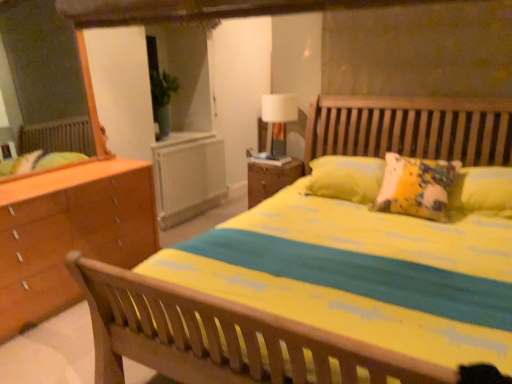
Question: Is point (293, 162) positioned closer to the camera than point (281, 115)?

Choices:
 (A) farther
 (B) closer

Answer: (B)

Question: From the image's perspective, relative to white fabric-covered lamp at upper center, is wooden nightstand at center above or below?

Choices:
 (A) above
 (B) below

Answer: (B)

Question: Which is nearer to the white plastic radiator at center?

Choices:
 (A) wooden nightstand at center
 (B) white fabric-covered lamp at upper center

Answer: (A)

Question: Based on their relative distances, which object is farther from the wooden nightstand at center?

Choices:
 (A) white fabric-covered lamp at upper center
 (B) white plastic radiator at center

Answer: (B)